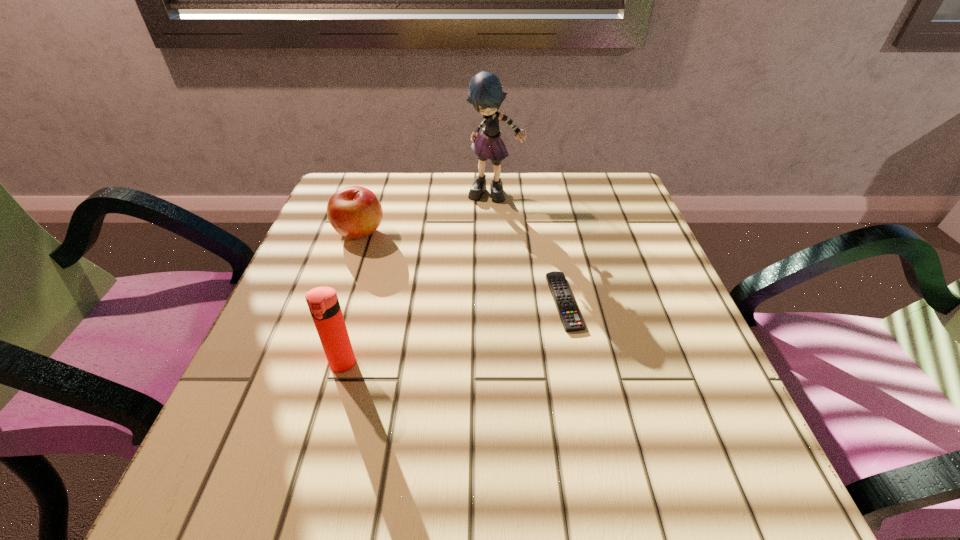
Where is `free space between the second object from right to left and the third farthest object`? free space between the second object from right to left and the third farthest object is located at coordinates (529, 248).

The width and height of the screenshot is (960, 540). Identify the location of vacant area that lies between the nearest object and the second object from right to left. (419, 280).

The height and width of the screenshot is (540, 960). I want to click on blank region between the farthest object and the second nearest object, so click(x=529, y=248).

You are a GUI agent. You are given a task and a screenshot of the screen. Output one action in this format:
    pyautogui.click(x=<x>, y=<y>)
    Task: Click on the free space between the thermos bottle and the remote control
    
    Given the screenshot: What is the action you would take?
    pyautogui.click(x=453, y=333)

Find the location of a particular element. The image size is (960, 540). the third closest object to the farthest object is located at coordinates (323, 303).

Image resolution: width=960 pixels, height=540 pixels. In order to click on object that ranks as the second closest to the apple in this screenshot , I will do `click(323, 303)`.

What are the coordinates of `free spot that satisfies the following two spatial constraints: 1. on the front-facing side of the tallest object; 2. on the right side of the shortest object` in the screenshot? It's located at (499, 301).

The width and height of the screenshot is (960, 540). I want to click on free space in the image that satisfies the following two spatial constraints: 1. on the front side of the second shortest object; 2. on the right side of the nearest object, so click(315, 364).